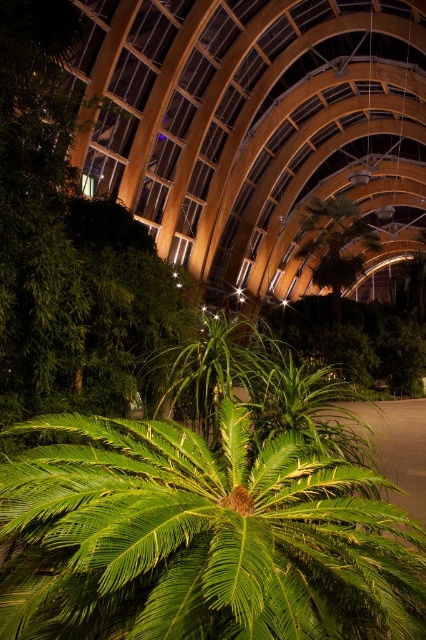
Based on the provided scene description, what are the coordinates of the green leafy palm tree at center?

The green leafy palm tree at center is located at coordinates (203, 538).

You are an interior designer planning to place a new piece of furniture in the conservatory. You notice both the green leafy palm tree at center and the green leafy plant at center. Which of these two takes up more space in the conservatory?

The green leafy plant at center takes up more space than the green leafy palm tree at center according to the description.